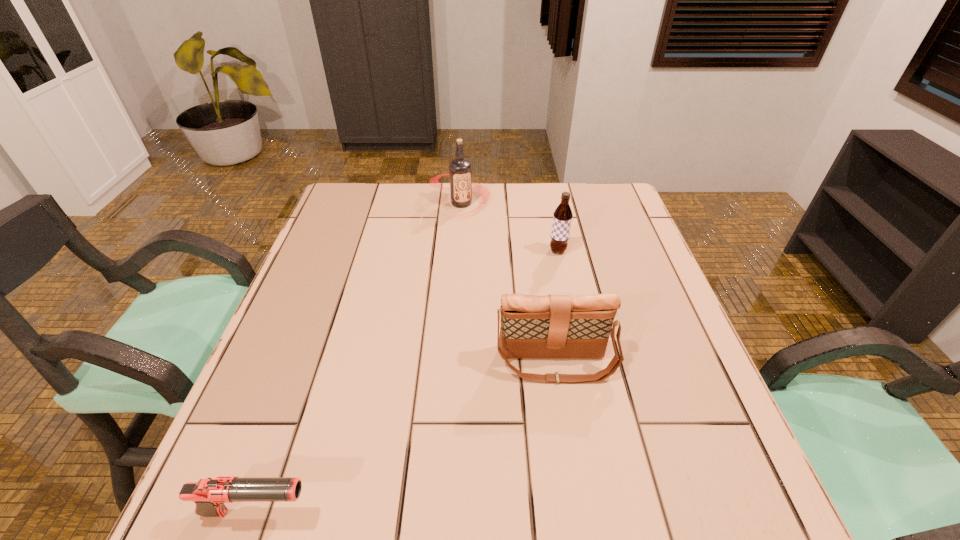
In the image, there is a desktop. In order to click on vacant space at the far right corner in this screenshot , I will do `click(572, 190)`.

Identify the location of free space between the farther root beer and the leftmost object. Image resolution: width=960 pixels, height=540 pixels. (359, 358).

The image size is (960, 540). Identify the location of vacant area between the nearest object and the shorter root beer. (407, 382).

Identify the location of free space between the second nearest object and the shortest object. This screenshot has width=960, height=540. (406, 438).

Where is `vacant point located between the farther root beer and the nearest object`? vacant point located between the farther root beer and the nearest object is located at coordinates (359, 358).

You are a GUI agent. You are given a task and a screenshot of the screen. Output one action in this format:
    pyautogui.click(x=<x>, y=<y>)
    Task: Click on the free space between the farthest object and the shortest object
    Image resolution: width=960 pixels, height=540 pixels.
    Given the screenshot: What is the action you would take?
    pyautogui.click(x=359, y=358)

Find the location of `vacant space that's between the second object from left to right and the third farthest object`. vacant space that's between the second object from left to right and the third farthest object is located at coordinates [x=509, y=284].

Where is `vacant region between the right root beer and the gun`? The height and width of the screenshot is (540, 960). vacant region between the right root beer and the gun is located at coordinates (407, 382).

Locate an element on the screen. The height and width of the screenshot is (540, 960). free space between the shortest object and the third nearest object is located at coordinates (407, 382).

Locate an element on the screen. The image size is (960, 540). object that is the third closest one to the gun is located at coordinates (460, 171).